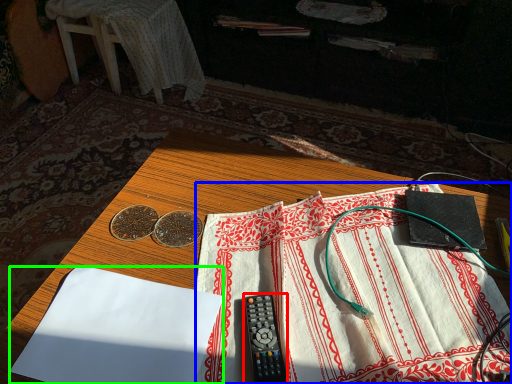
Question: Which object is positioned closest to stationery (highlighted by a red box)? Select from sheet (highlighted by a blue box) and sheet (highlighted by a green box).

Choices:
 (A) sheet
 (B) sheet

Answer: (A)